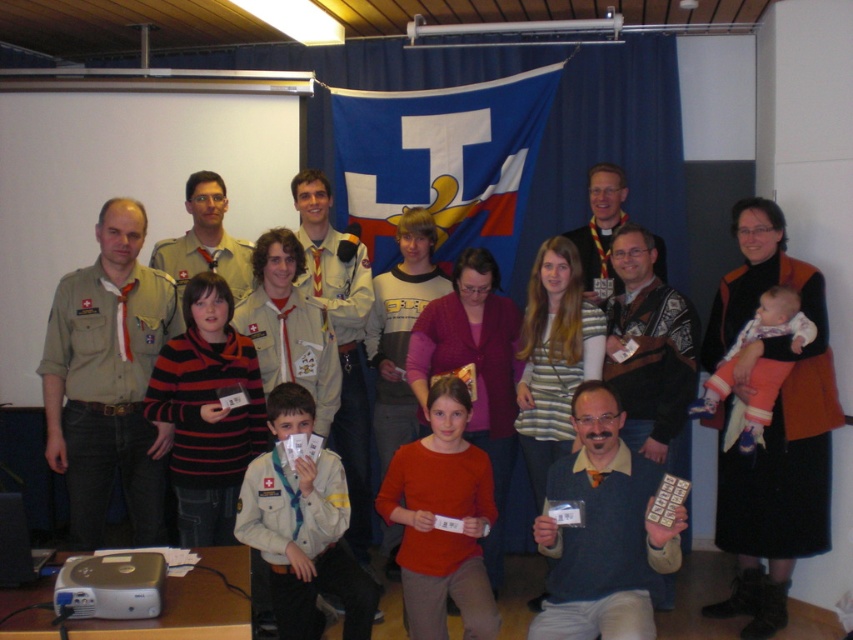
Question: Can you confirm if blue fabric flag at center is bigger than matte orange sweater at center?

Choices:
 (A) no
 (B) yes

Answer: (B)

Question: Which object appears closest to the camera in this image?

Choices:
 (A) soft pink fabric baby at right
 (B) white matte uniform at center

Answer: (B)

Question: Among these points, which one is farthest from the camera?

Choices:
 (A) (x=253, y=392)
 (B) (x=506, y=259)
 (C) (x=779, y=376)
 (D) (x=285, y=588)

Answer: (B)

Question: Is striped sweater at center in front of soft pink fabric baby at right?

Choices:
 (A) no
 (B) yes

Answer: (B)

Question: Which object is closer to the camera taking this photo?

Choices:
 (A) matte orange sweater at center
 (B) white matte uniform at center
 (C) striped sweater at center
 (D) soft pink fabric baby at right

Answer: (B)

Question: Is blue fabric flag at center further to camera compared to soft pink fabric baby at right?

Choices:
 (A) yes
 (B) no

Answer: (A)